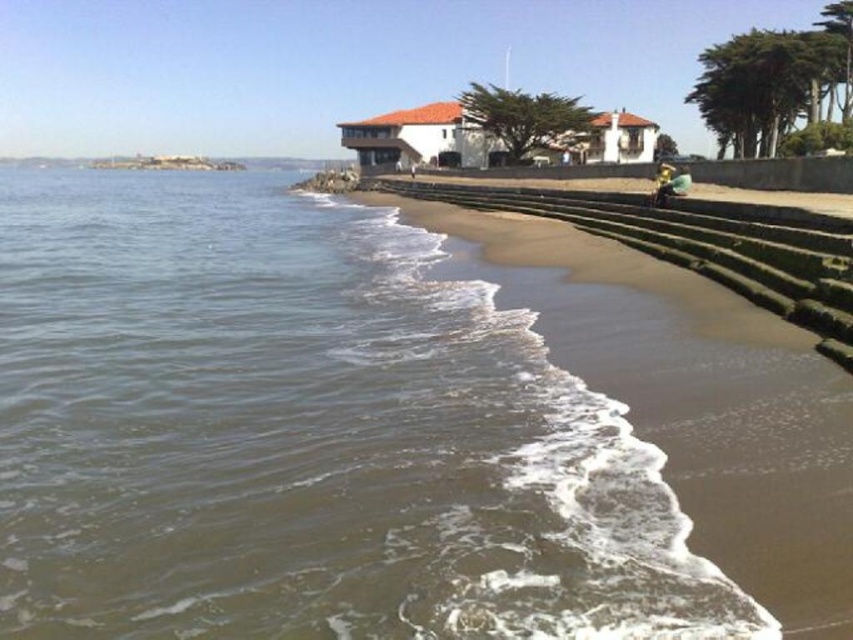
Between brown matte water at lower left and golden metallic helmet at lower right, which one appears on the left side from the viewer's perspective?

brown matte water at lower left is more to the left.

Consider the image. Does brown matte water at lower left have a greater width compared to golden metallic helmet at lower right?

Indeed, brown matte water at lower left has a greater width compared to golden metallic helmet at lower right.

Between point (468, 515) and point (665, 186), which one is positioned in front?

Point (468, 515) is in front.

Locate an element on the screen. brown matte water at lower left is located at coordinates (306, 435).